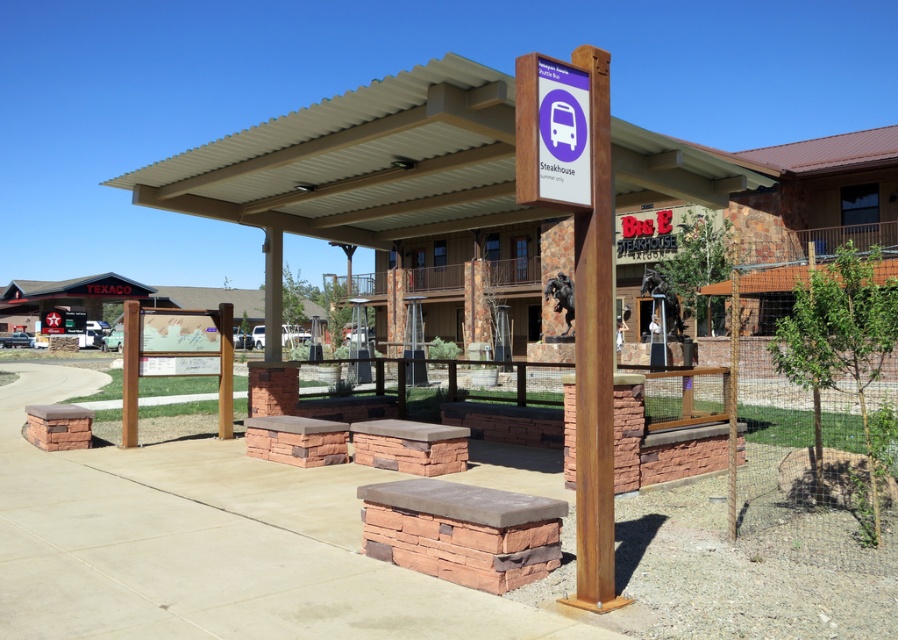
Question: Which object is farther from the camera taking this photo?

Choices:
 (A) purple matte sign at upper center
 (B) brown wood post at center
 (C) brown corrugated metal canopy at center

Answer: (B)

Question: Can you confirm if brown wood pergola at center is positioned below purple matte sign at upper center?

Choices:
 (A) no
 (B) yes

Answer: (A)

Question: Can you confirm if brown corrugated metal canopy at center is thinner than rustic wood signpost at center?

Choices:
 (A) no
 (B) yes

Answer: (A)

Question: Which point is closer to the camera taking this photo?

Choices:
 (A) (542, 81)
 (B) (608, 604)

Answer: (A)

Question: Is purple matte sign at upper center below brown wood post at center?

Choices:
 (A) no
 (B) yes

Answer: (A)

Question: Estimate the real-world distances between objects in this image. Which object is farther from the purple matte sign at upper center?

Choices:
 (A) brown corrugated metal canopy at center
 (B) brown wood post at center

Answer: (B)